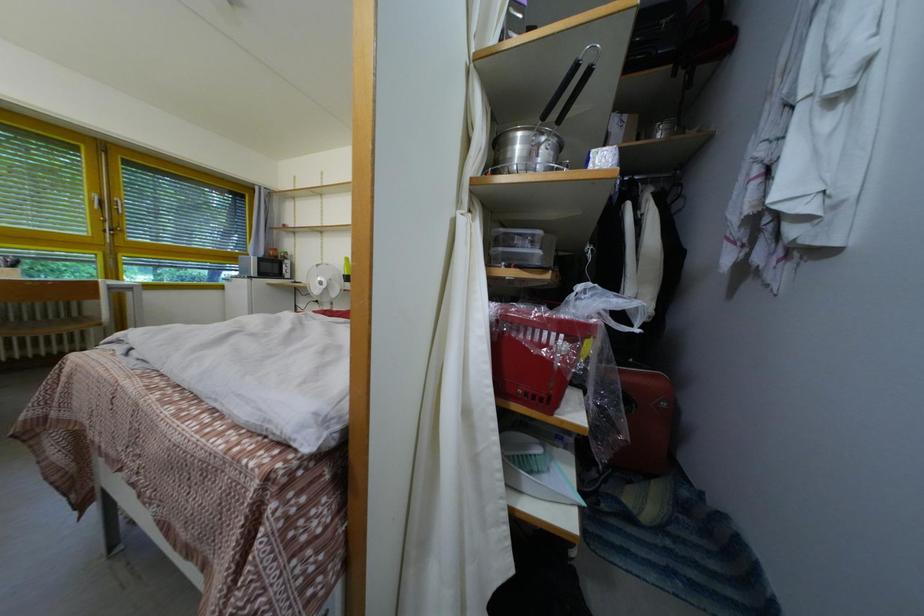
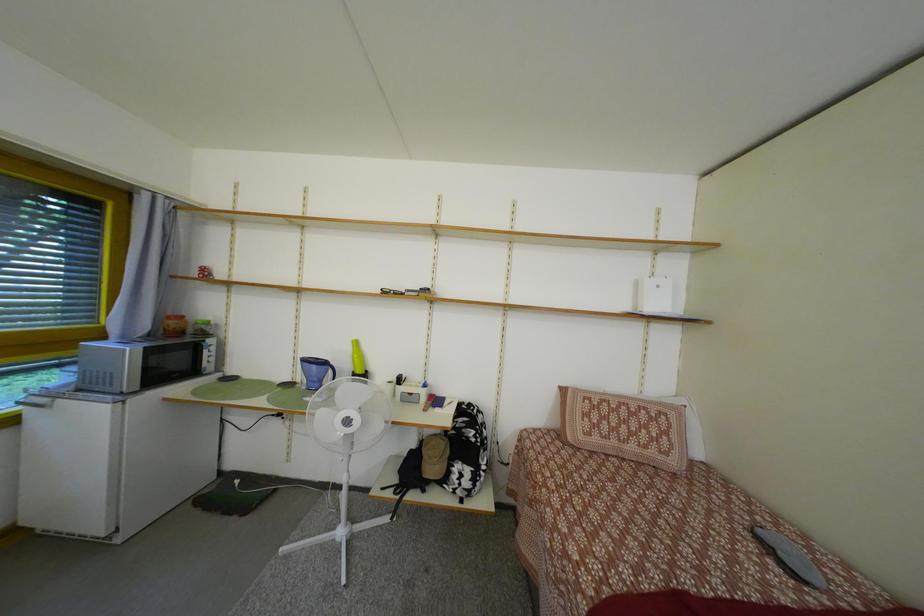
Which direction would the cameraman need to move to produce the second image?

The cameraman moved toward left, forward.